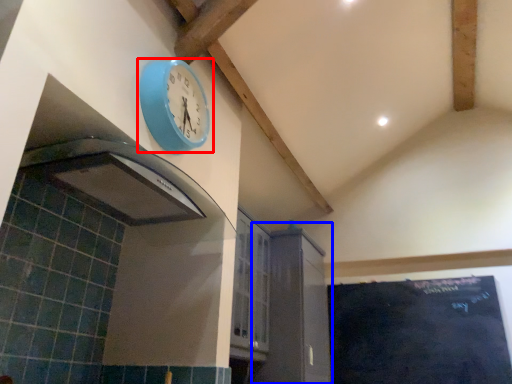
Question: Among these objects, which one is nearest to the camera, wall clock (highlighted by a red box) or cabinetry (highlighted by a blue box)?

Choices:
 (A) wall clock
 (B) cabinetry

Answer: (A)